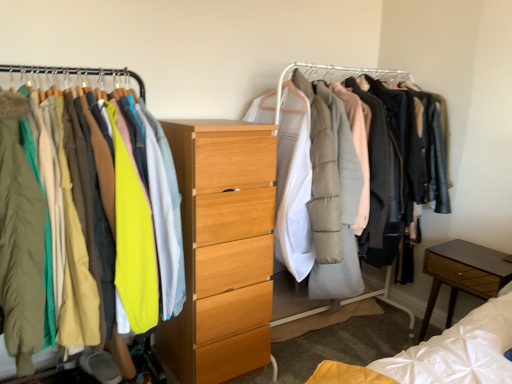
Find the location of a particular element. Image resolution: width=512 pixels, height=384 pixels. free point above brown wood nightstand at lower right (from a real-world perspective) is located at coordinates (475, 250).